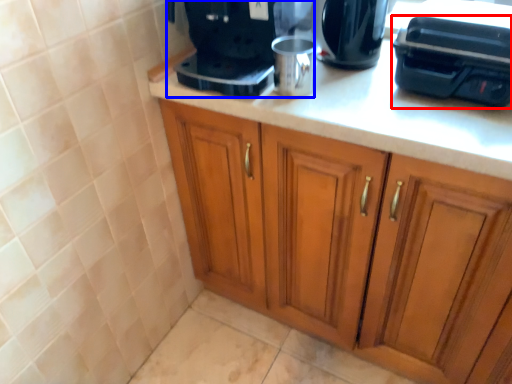
Question: Which object appears farthest to the camera in this image, appliance (highlighted by a red box) or home appliance (highlighted by a blue box)?

Choices:
 (A) appliance
 (B) home appliance

Answer: (B)